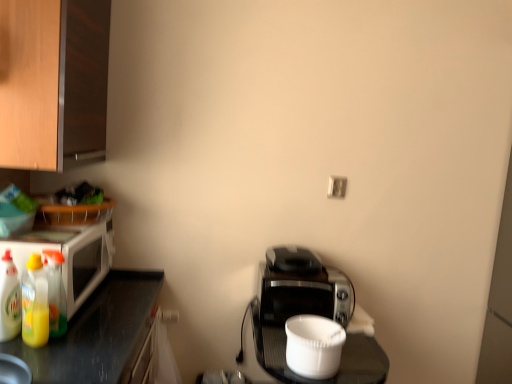
Question: Is black plastic toaster at center, the second appliance when ordered from front to back, bigger than wooden cabinet at upper left?

Choices:
 (A) yes
 (B) no

Answer: (B)

Question: Considering the relative sizes of black plastic toaster at center, the second appliance when ordered from front to back, and wooden cabinet at upper left in the image provided, is black plastic toaster at center, the second appliance when ordered from front to back, wider than wooden cabinet at upper left?

Choices:
 (A) no
 (B) yes

Answer: (A)

Question: Is black plastic toaster at center, the second appliance when ordered from front to back, in front of wooden cabinet at upper left?

Choices:
 (A) no
 (B) yes

Answer: (A)

Question: Does black plastic toaster at center, which is the first appliance from back to front, have a smaller size compared to wooden cabinet at upper left?

Choices:
 (A) yes
 (B) no

Answer: (A)

Question: Is black plastic toaster at center, which is the first appliance from back to front, further to the viewer compared to wooden cabinet at upper left?

Choices:
 (A) yes
 (B) no

Answer: (A)

Question: In terms of width, does white plastic electric outlet at upper center look wider or thinner when compared to translucent plastic bottle at left, marked as the first bottle in a left-to-right arrangement?

Choices:
 (A) wide
 (B) thin

Answer: (B)

Question: Is white plastic electric outlet at upper center in front of or behind translucent plastic bottle at left, marked as the first bottle in a left-to-right arrangement, in the image?

Choices:
 (A) behind
 (B) front

Answer: (A)

Question: Is point (344, 180) positioned closer to the camera than point (10, 329)?

Choices:
 (A) farther
 (B) closer

Answer: (A)

Question: Which is correct: white plastic electric outlet at upper center is inside translucent plastic bottle at left, the third bottle from the right, or outside of it?

Choices:
 (A) outside
 (B) inside

Answer: (A)

Question: From the image's perspective, relative to white plastic electric outlet at upper center, is white glossy microwave at left above or below?

Choices:
 (A) below
 (B) above

Answer: (A)

Question: Considering the positions of white glossy microwave at left and white plastic electric outlet at upper center in the image, is white glossy microwave at left bigger or smaller than white plastic electric outlet at upper center?

Choices:
 (A) small
 (B) big

Answer: (B)

Question: Is white glossy microwave at left inside or outside of white plastic electric outlet at upper center?

Choices:
 (A) inside
 (B) outside

Answer: (B)

Question: Considering the positions of white glossy microwave at left and white plastic electric outlet at upper center in the image, is white glossy microwave at left wider or thinner than white plastic electric outlet at upper center?

Choices:
 (A) thin
 (B) wide

Answer: (B)

Question: Relative to white plastic container at center, acting as the 1th appliance starting from the front, is white glossy microwave at left in front or behind?

Choices:
 (A) behind
 (B) front

Answer: (B)

Question: Do you think white glossy microwave at left is within white plastic container at center, acting as the 1th appliance starting from the front, or outside of it?

Choices:
 (A) outside
 (B) inside

Answer: (A)